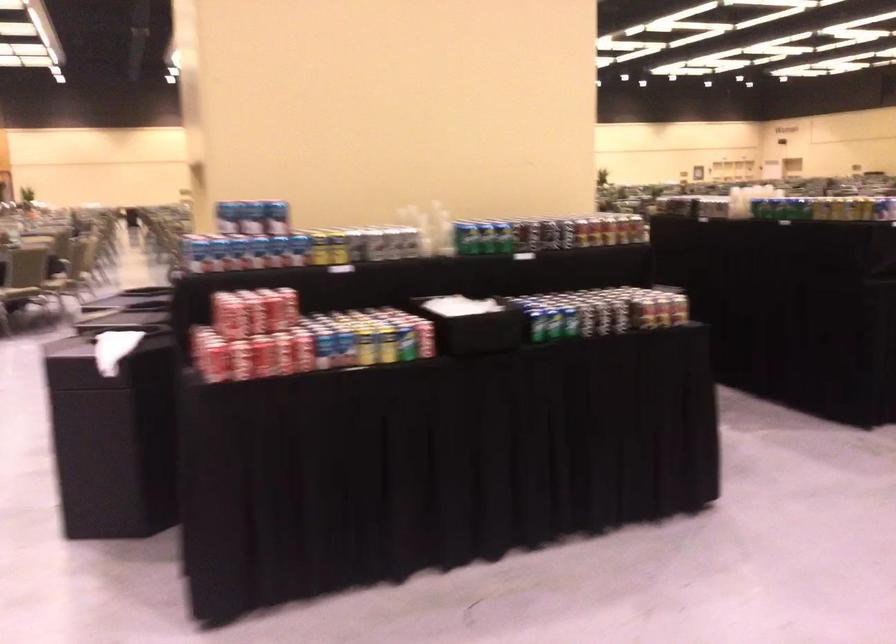
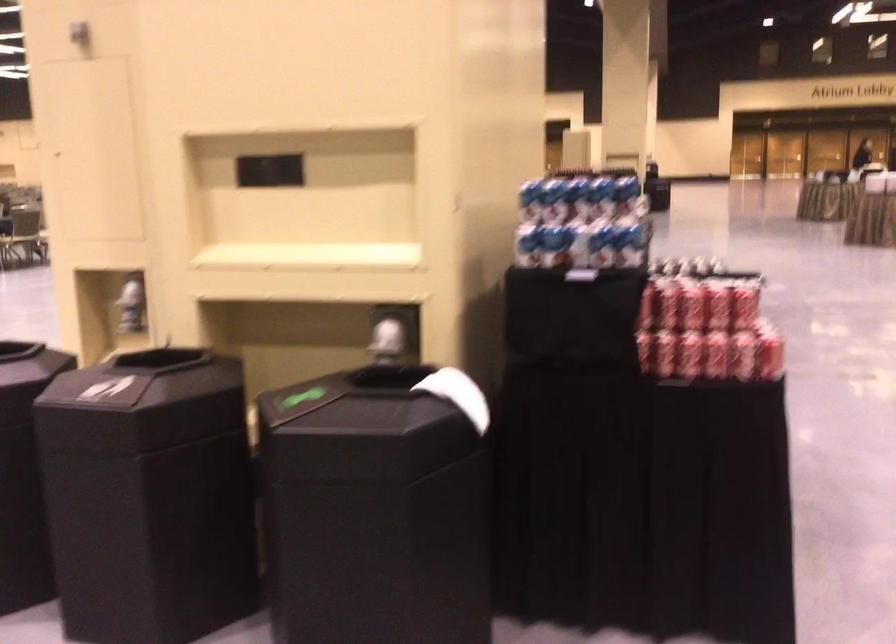
Question: I am providing you with two images of the same scene from different viewpoints. Please identify which objects are invisible in image2.

Choices:
 (A) white paper towel
 (B) red soda can
 (C) blue and white can
 (D) none of these

Answer: (D)